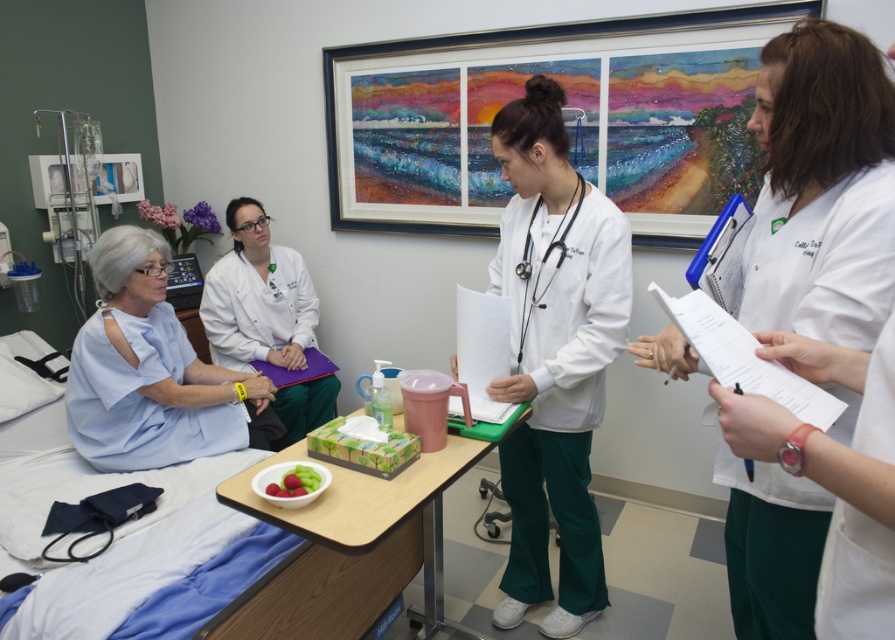
From the picture: Can you confirm if white smooth paper at center is positioned above white smooth uniform at center?

Yes.

The width and height of the screenshot is (895, 640). What do you see at coordinates (823, 188) in the screenshot?
I see `white smooth paper at center` at bounding box center [823, 188].

In order to click on white smooth paper at center in this screenshot , I will do `click(823, 188)`.

This screenshot has height=640, width=895. What do you see at coordinates (823, 188) in the screenshot?
I see `white smooth paper at center` at bounding box center [823, 188].

Locate an element on the screen. The height and width of the screenshot is (640, 895). white smooth paper at center is located at coordinates (823, 188).

Can you confirm if white smooth paper at center is wider than light blue fabric at left?

No.

Who is positioned more to the right, white smooth paper at center or light blue fabric at left?

white smooth paper at center

Which is in front, point (808, 540) or point (90, 396)?

Point (808, 540) is more forward.

This screenshot has height=640, width=895. Identify the location of white smooth paper at center. (823, 188).